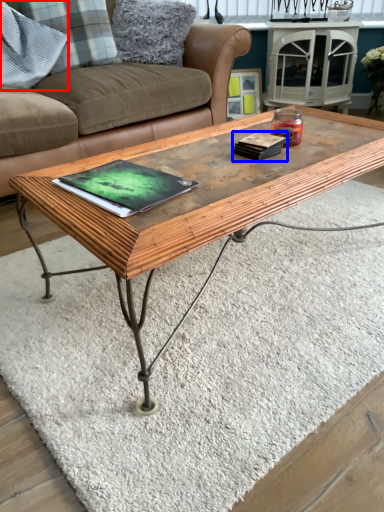
Question: Among these objects, which one is nearest to the camera, pillow (highlighted by a red box) or book (highlighted by a blue box)?

Choices:
 (A) pillow
 (B) book

Answer: (B)